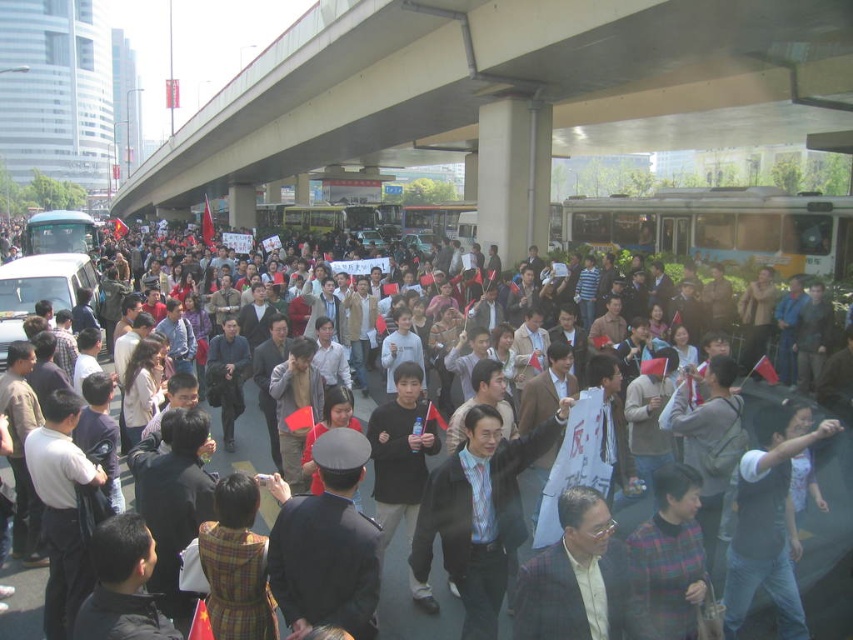
You are a photographer positioned at the center of the overpass. There are two points marked in the image where you want to capture closeup shots. The first point is at coordinate point (x=843, y=611) and the second is at point (x=440, y=547). Which point is closer to your current position?

Point (x=843, y=611) is in front of point (x=440, y=547), so it is closer to your current position at the center of the overpass.

You are a photographer standing in the crowd and want to take a photo of both point (450, 420) and point (602, 579). Which point is closer to your camera?

Point (602, 579) is closer to the camera than point (450, 420).

You are a photographer at the protest scene. You want to take a photo of the plaid suit at center and the dark blue uniform at center. Which one is closer to the camera?

The dark blue uniform at center is closer to the camera because the plaid suit at center is behind it.